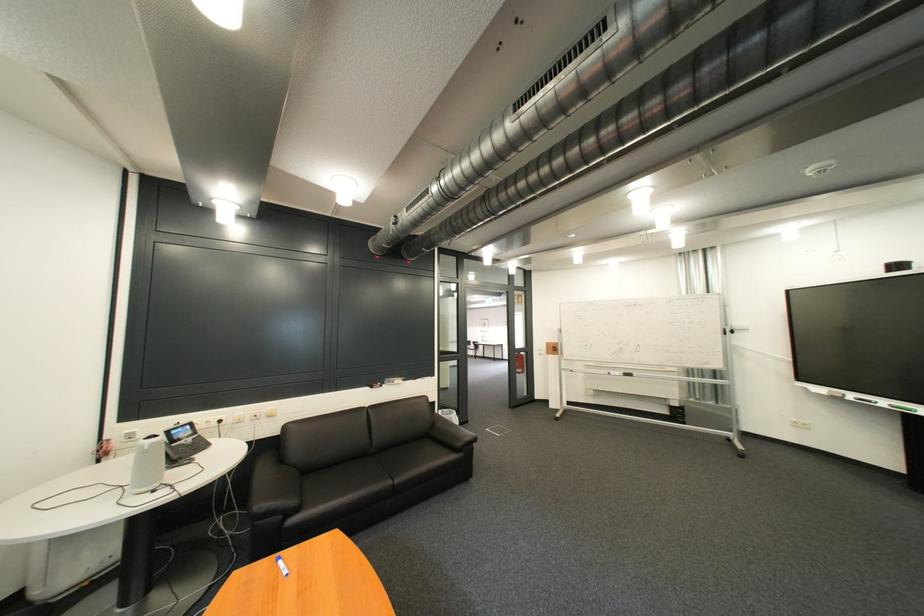
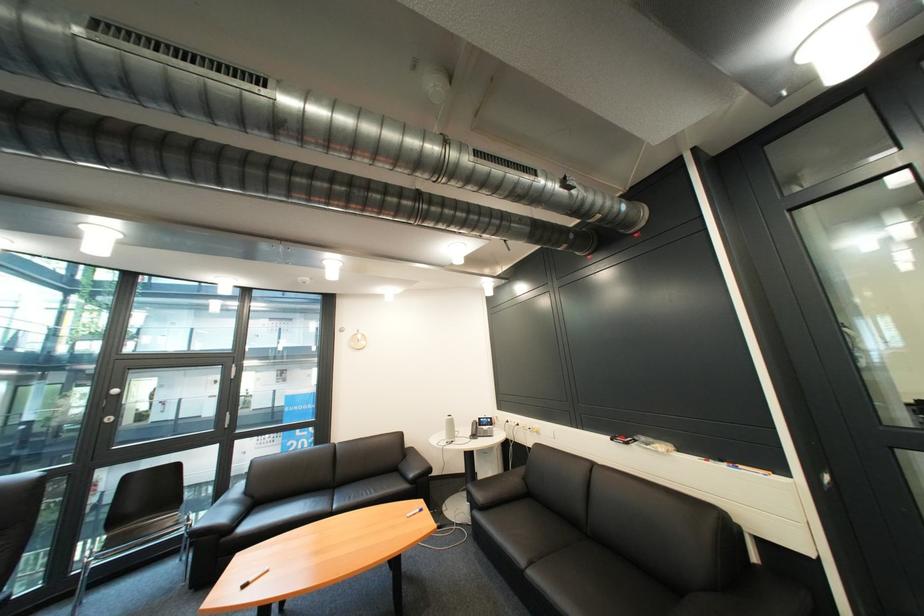
Locate, in the second image, the point that corresponds to (234,424) in the first image.

(531, 426)